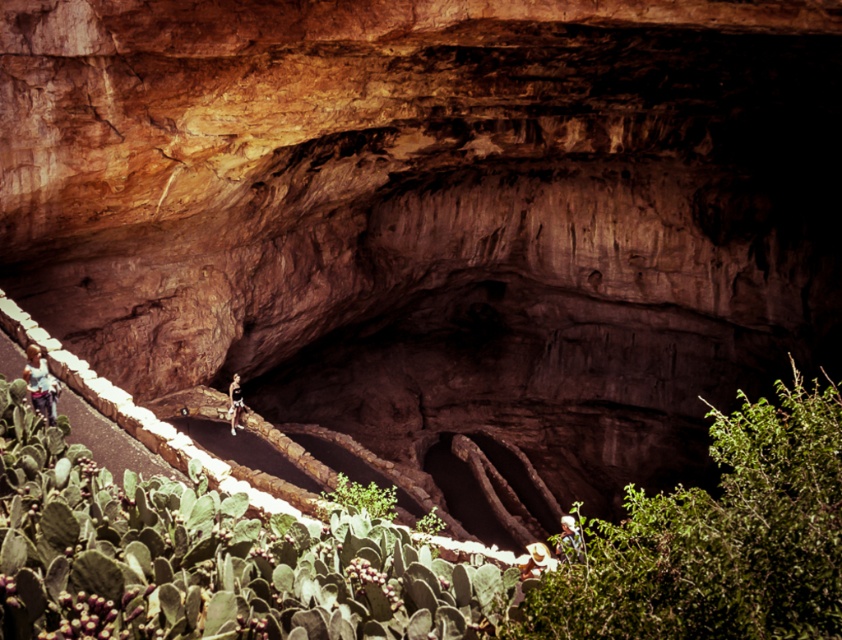
Is light blue denim jeans at left above white textured hat at lower center?

Correct, light blue denim jeans at left is located above white textured hat at lower center.

Who is lower down, light blue denim jeans at left or white textured hat at lower center?

white textured hat at lower center is below.

The height and width of the screenshot is (640, 842). What are the coordinates of `light blue denim jeans at left` in the screenshot? It's located at (40, 381).

Which is more to the left, white fabric hat at lower center or light brown leather jacket at center?

light brown leather jacket at center

Is point (547, 566) positioned before point (238, 387)?

That is True.

Between point (537, 568) and point (230, 388), which one is positioned in front?

Point (537, 568) is more forward.

Find the location of a particular element. white fabric hat at lower center is located at coordinates (536, 560).

Who is lower down, green spiky cactus at lower left or green leafy bush at lower right?

Positioned lower is green leafy bush at lower right.

Does green spiky cactus at lower left have a smaller size compared to green leafy bush at lower right?

Yes.

Is point (220, 522) positioned after point (822, 465)?

Yes, point (220, 522) is behind point (822, 465).

At what (x,y) coordinates should I click in order to perform the action: click on green spiky cactus at lower left. Please return your answer as a coordinate pair (x, y). This screenshot has width=842, height=640. Looking at the image, I should click on (205, 557).